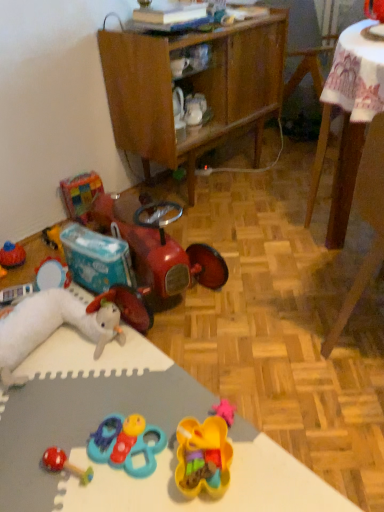
This screenshot has width=384, height=512. In order to click on vacant area in front of teal plastic toy at center, which appears as the fourth toy when viewed from the left in this screenshot , I will do `click(128, 494)`.